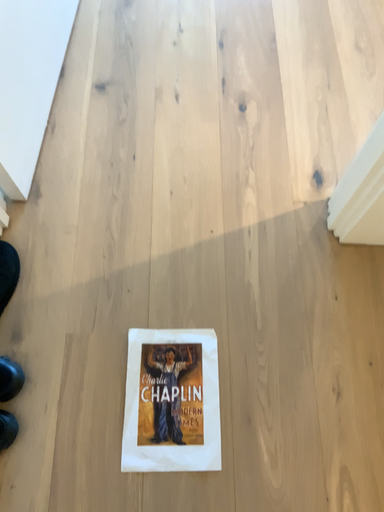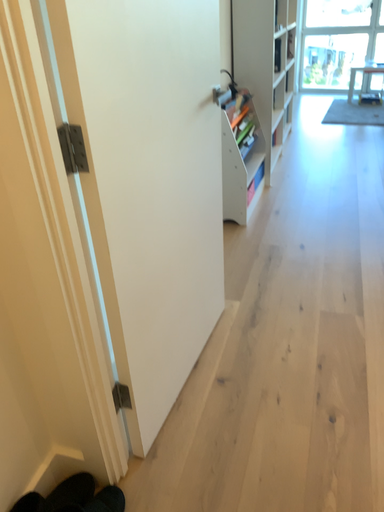
Question: Which way did the camera rotate in the video?

Choices:
 (A) rotated right
 (B) rotated left

Answer: (B)